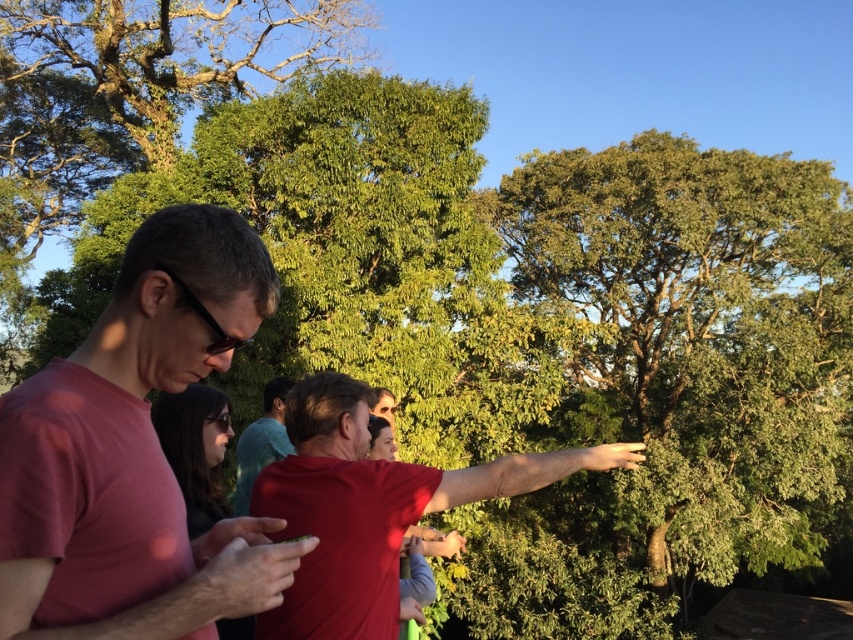
How much distance is there between red matte shirt at center and teal fabric shirt at center?

red matte shirt at center is 6.33 feet from teal fabric shirt at center.

Is red matte shirt at center positioned in front of teal fabric shirt at center?

Yes, it is in front of teal fabric shirt at center.

Which is behind, point (355, 445) or point (248, 483)?

The point (248, 483) is behind.

This screenshot has width=853, height=640. Identify the location of red matte shirt at center. pos(372,508).

Can you confirm if green leafy tree at upper right is taller than teal fabric shirt at center?

Yes.

Is point (706, 529) more distant than point (236, 465)?

Yes, point (706, 529) is farther from viewer.

The height and width of the screenshot is (640, 853). I want to click on green leafy tree at upper right, so (693, 346).

In the scene shown: Is matte red shirt at center taller than teal fabric shirt at center?

Correct, matte red shirt at center is much taller as teal fabric shirt at center.

Is matte red shirt at center in front of teal fabric shirt at center?

Yes, it is.

Is point (22, 493) farther from camera compared to point (264, 448)?

No, it is not.

This screenshot has height=640, width=853. In order to click on matte red shirt at center in this screenshot , I will do tap(134, 452).